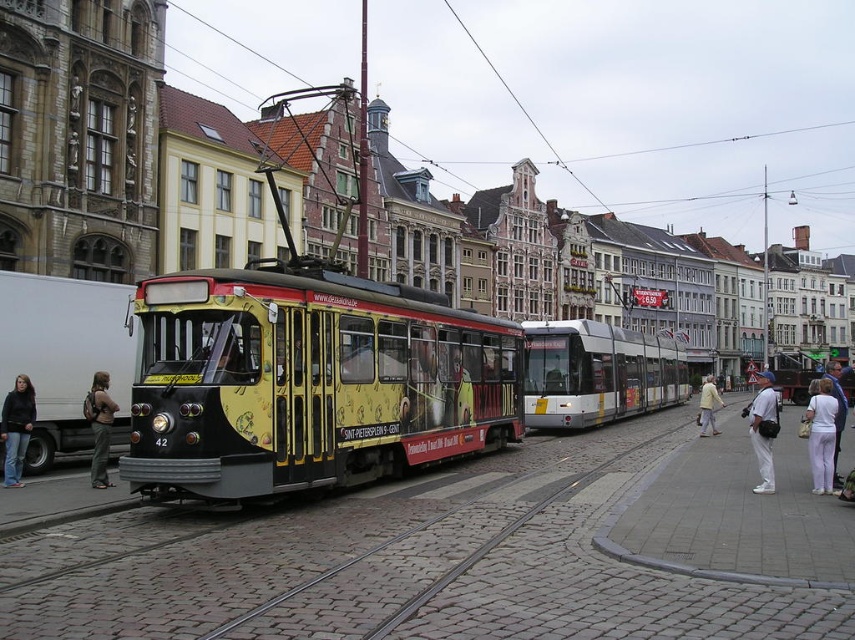
Between white cotton shirt at center and dark gray backpack at left, which one appears on the right side from the viewer's perspective?

white cotton shirt at center

Can you confirm if white cotton shirt at center is positioned below dark gray backpack at left?

Yes, white cotton shirt at center is below dark gray backpack at left.

The image size is (855, 640). Find the location of `white cotton shirt at center`. white cotton shirt at center is located at coordinates (764, 429).

How much distance is there between denim jacket at lower left and light yellow jacket at center?

denim jacket at lower left is 53.74 meters away from light yellow jacket at center.

Does denim jacket at lower left have a smaller size compared to light yellow jacket at center?

Yes.

Locate an element on the screen. denim jacket at lower left is located at coordinates (x=16, y=428).

This screenshot has height=640, width=855. What are the coordinates of `denim jacket at lower left` in the screenshot? It's located at (16, 428).

Can you confirm if light beige pants at lower right is positioned to the left of dark gray backpack at left?

In fact, light beige pants at lower right is to the right of dark gray backpack at left.

You are a GUI agent. You are given a task and a screenshot of the screen. Output one action in this format:
    pyautogui.click(x=<x>, y=<y>)
    Task: Click on the light beige pants at lower right
    The image size is (855, 640).
    Given the screenshot: What is the action you would take?
    pyautogui.click(x=821, y=435)

You are a GUI agent. You are given a task and a screenshot of the screen. Output one action in this format:
    pyautogui.click(x=<x>, y=<y>)
    Task: Click on the light beige pants at lower right
    The height and width of the screenshot is (640, 855).
    Given the screenshot: What is the action you would take?
    pyautogui.click(x=821, y=435)